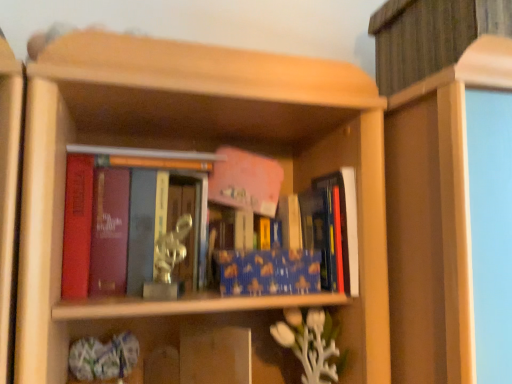
Question: Does metallic statue at center, the second book when ordered from right to left, appear on the left side of blue glossy book at center, the first book when ordered from right to left?

Choices:
 (A) yes
 (B) no

Answer: (A)

Question: From a real-world perspective, does metallic statue at center, the second book when ordered from right to left, sit lower than blue glossy book at center, which ranks as the second book in left-to-right order?

Choices:
 (A) no
 (B) yes

Answer: (A)

Question: Is metallic statue at center, arranged as the 1th book when viewed from the left, oriented towards blue glossy book at center, the first book when ordered from right to left?

Choices:
 (A) yes
 (B) no

Answer: (B)

Question: Does metallic statue at center, arranged as the 1th book when viewed from the left, contain blue glossy book at center, which ranks as the second book in left-to-right order?

Choices:
 (A) no
 (B) yes

Answer: (A)

Question: Is metallic statue at center, the second book when ordered from right to left, at the right side of blue glossy book at center, the first book when ordered from right to left?

Choices:
 (A) no
 (B) yes

Answer: (A)

Question: In terms of width, does blue glossy book at center, which ranks as the second book in left-to-right order, look wider or thinner when compared to metallic statue at center, the second book when ordered from right to left?

Choices:
 (A) thin
 (B) wide

Answer: (A)

Question: Based on their sizes in the image, would you say blue glossy book at center, the first book when ordered from right to left, is bigger or smaller than metallic statue at center, arranged as the 1th book when viewed from the left?

Choices:
 (A) small
 (B) big

Answer: (A)

Question: From the image's perspective, relative to metallic statue at center, arranged as the 1th book when viewed from the left, is blue glossy book at center, the first book when ordered from right to left, above or below?

Choices:
 (A) below
 (B) above

Answer: (A)

Question: Is blue glossy book at center, which ranks as the second book in left-to-right order, taller or shorter than metallic statue at center, arranged as the 1th book when viewed from the left?

Choices:
 (A) tall
 (B) short

Answer: (B)

Question: Do you think metallic silver statue at center is within blue glossy book at center, the first book when ordered from right to left, or outside of it?

Choices:
 (A) outside
 (B) inside

Answer: (A)

Question: Considering the positions of metallic silver statue at center and blue glossy book at center, the first book when ordered from right to left, in the image, is metallic silver statue at center wider or thinner than blue glossy book at center, the first book when ordered from right to left,?

Choices:
 (A) wide
 (B) thin

Answer: (A)

Question: In terms of height, does metallic silver statue at center look taller or shorter compared to blue glossy book at center, which ranks as the second book in left-to-right order?

Choices:
 (A) short
 (B) tall

Answer: (B)

Question: Relative to blue glossy book at center, which ranks as the second book in left-to-right order, is metallic silver statue at center in front or behind?

Choices:
 (A) front
 (B) behind

Answer: (A)

Question: In terms of size, does metallic silver statue at center appear bigger or smaller than metallic statue at center, the second book when ordered from right to left?

Choices:
 (A) small
 (B) big

Answer: (A)

Question: From the image's perspective, relative to metallic statue at center, arranged as the 1th book when viewed from the left, is metallic silver statue at center above or below?

Choices:
 (A) above
 (B) below

Answer: (B)